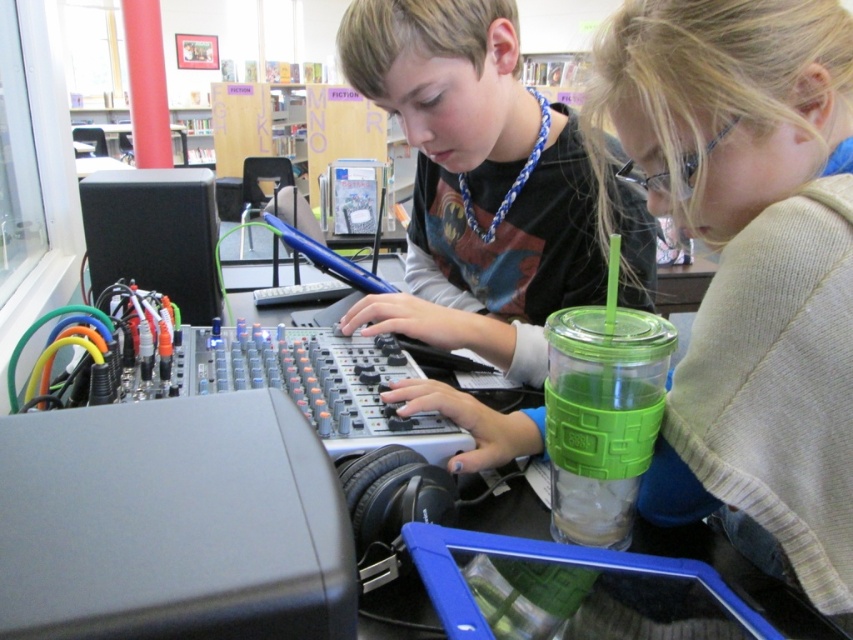
Question: Which point is closer to the camera?

Choices:
 (A) green plastic cup at center
 (B) matte black shirt at center

Answer: (A)

Question: Which point is farther to the camera?

Choices:
 (A) (387, 24)
 (B) (779, 540)

Answer: (A)

Question: Can you confirm if green plastic cup at center is wider than matte black shirt at center?

Choices:
 (A) no
 (B) yes

Answer: (A)

Question: Does green plastic cup at center appear under matte black shirt at center?

Choices:
 (A) no
 (B) yes

Answer: (B)

Question: Does green plastic cup at center appear over matte black shirt at center?

Choices:
 (A) yes
 (B) no

Answer: (B)

Question: Which object appears closest to the camera in this image?

Choices:
 (A) green plastic cup at center
 (B) matte black shirt at center

Answer: (A)